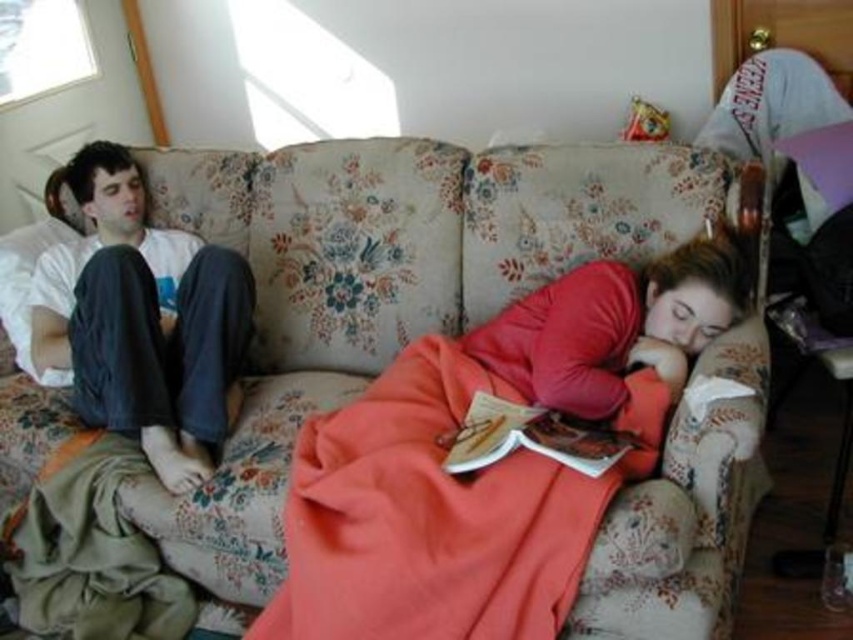
Who is taller, coral fleece blanket at lower center or white cotton shirt at upper left?

white cotton shirt at upper left is taller.

I want to click on coral fleece blanket at lower center, so click(x=438, y=513).

You are a GUI agent. You are given a task and a screenshot of the screen. Output one action in this format:
    pyautogui.click(x=<x>, y=<y>)
    Task: Click on the coral fleece blanket at lower center
    The width and height of the screenshot is (853, 640).
    Given the screenshot: What is the action you would take?
    pyautogui.click(x=438, y=513)

Which is more to the left, coral fleece blanket at lower center or hardcover book at center?

Positioned to the left is coral fleece blanket at lower center.

The image size is (853, 640). In order to click on coral fleece blanket at lower center in this screenshot , I will do `click(438, 513)`.

Describe the element at coordinates (438, 513) in the screenshot. I see `coral fleece blanket at lower center` at that location.

Locate an element on the screen. The image size is (853, 640). coral fleece blanket at lower center is located at coordinates (438, 513).

Does floral fabric couch at center appear on the left side of coral fleece blanket at lower center?

Yes, floral fabric couch at center is to the left of coral fleece blanket at lower center.

Does floral fabric couch at center have a greater height compared to coral fleece blanket at lower center?

Correct, floral fabric couch at center is much taller as coral fleece blanket at lower center.

Which is behind, point (399, 202) or point (325, 474)?

The point (399, 202) is behind.

Find the location of a particular element. This screenshot has height=640, width=853. floral fabric couch at center is located at coordinates (163, 492).